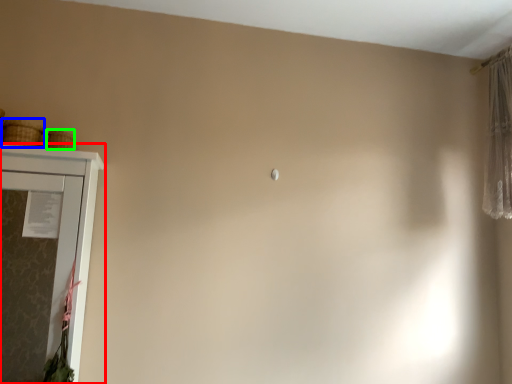
Question: Based on their relative distances, which object is nearer to cupboard (highlighted by a red box)? Choose from basket (highlighted by a blue box) and basket (highlighted by a green box).

Choices:
 (A) basket
 (B) basket

Answer: (A)